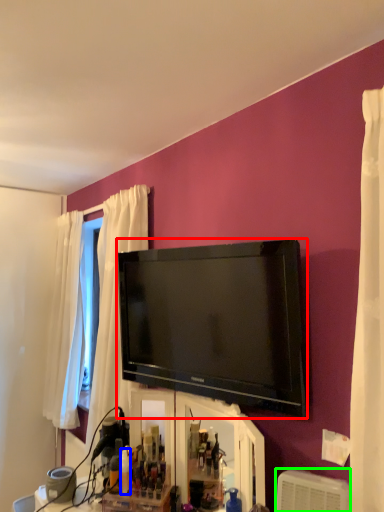
Question: Estimate the real-world distances between objects in this image. Which object is closer to television (highlighted by a red box), toiletry (highlighted by a blue box) or air conditioner (highlighted by a green box)?

Choices:
 (A) toiletry
 (B) air conditioner

Answer: (B)